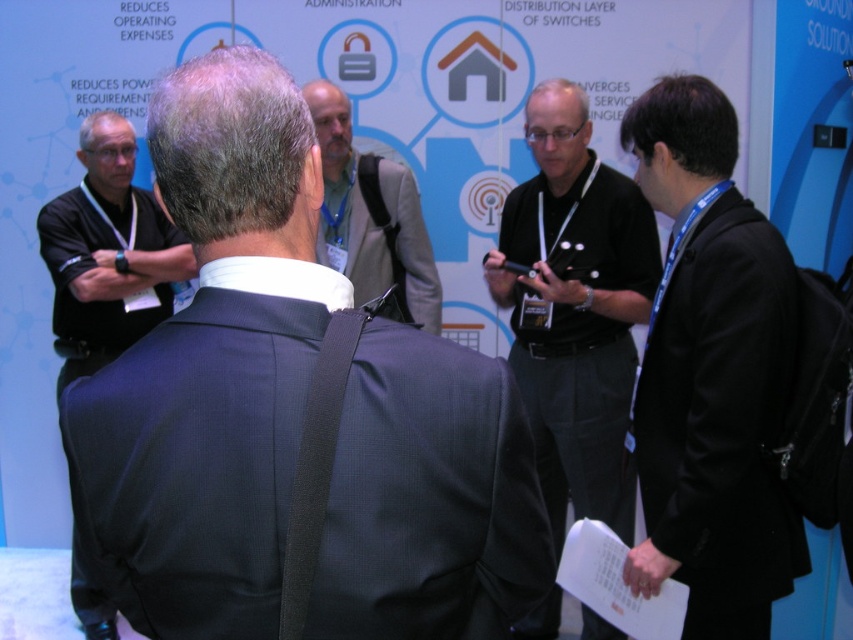
Which is above, black shirt at center or gray suit at center?

gray suit at center

Looking at this image, how distant is black shirt at center from gray suit at center?

They are 18.70 inches apart.

Describe the element at coordinates (575, 307) in the screenshot. I see `black shirt at center` at that location.

Find the location of `black shirt at center`. black shirt at center is located at coordinates (575, 307).

Which of these two, black shirt at center or black fabric shirt at left, stands taller?

black shirt at center is taller.

Is black shirt at center positioned in front of black fabric shirt at left?

Yes, black shirt at center is closer to the viewer.

Between point (624, 408) and point (173, 257), which one is positioned in front?

Point (624, 408) is more forward.

You are a GUI agent. You are given a task and a screenshot of the screen. Output one action in this format:
    pyautogui.click(x=<x>, y=<y>)
    Task: Click on the black shirt at center
    
    Given the screenshot: What is the action you would take?
    pyautogui.click(x=575, y=307)

Does dark gray suit at center lie in front of black fabric shirt at left?

Yes, it is in front of black fabric shirt at left.

Is dark gray suit at center to the left of black fabric shirt at left from the viewer's perspective?

No, dark gray suit at center is not to the left of black fabric shirt at left.

This screenshot has height=640, width=853. In order to click on dark gray suit at center in this screenshot , I will do `click(210, 365)`.

The width and height of the screenshot is (853, 640). I want to click on dark gray suit at center, so click(x=210, y=365).